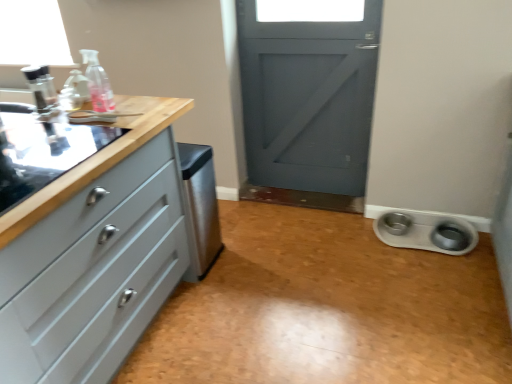
Locate an element on the screen. This screenshot has width=512, height=384. unoccupied region to the right of transparent plastic bottle at upper left is located at coordinates (136, 110).